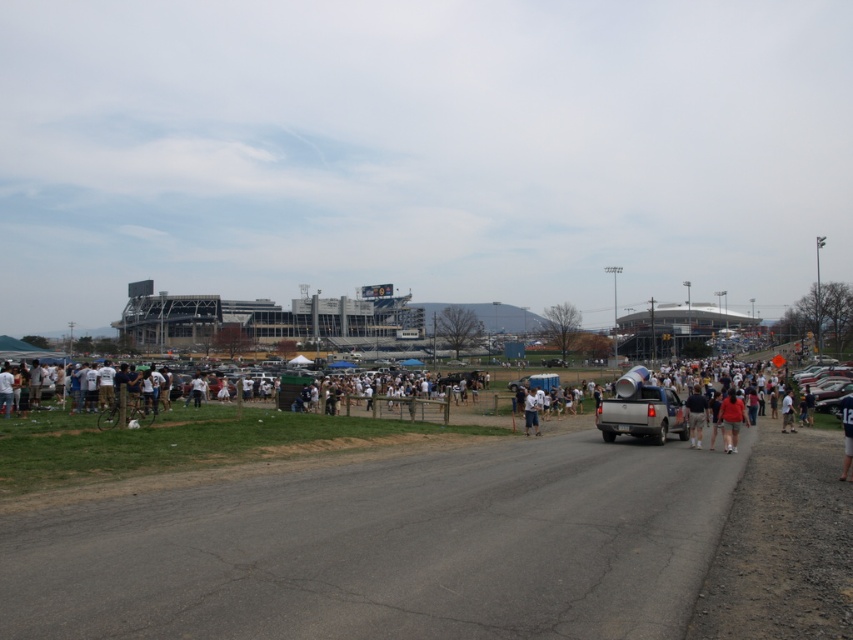
Question: Can you confirm if metallic silver car at right is positioned above tan fabric shirt at center?

Choices:
 (A) yes
 (B) no

Answer: (A)

Question: Does tan fabric shirt at center appear on the left side of white cotton shirt at center?

Choices:
 (A) yes
 (B) no

Answer: (B)

Question: Among these objects, which one is nearest to the camera?

Choices:
 (A) blue jersey at center
 (B) metallic silver car at right

Answer: (A)

Question: Can you confirm if tan fabric shirt at center is bigger than blue jersey at center?

Choices:
 (A) yes
 (B) no

Answer: (A)

Question: Which object appears closest to the camera in this image?

Choices:
 (A) tan fabric shirt at center
 (B) silver metallic truck at center-right
 (C) white cotton shirt at center
 (D) matte red shirt at center

Answer: (D)

Question: Among these points, which one is farthest from the camera?

Choices:
 (A) (851, 461)
 (B) (703, 420)
 (C) (537, 435)
 (D) (732, 410)

Answer: (C)